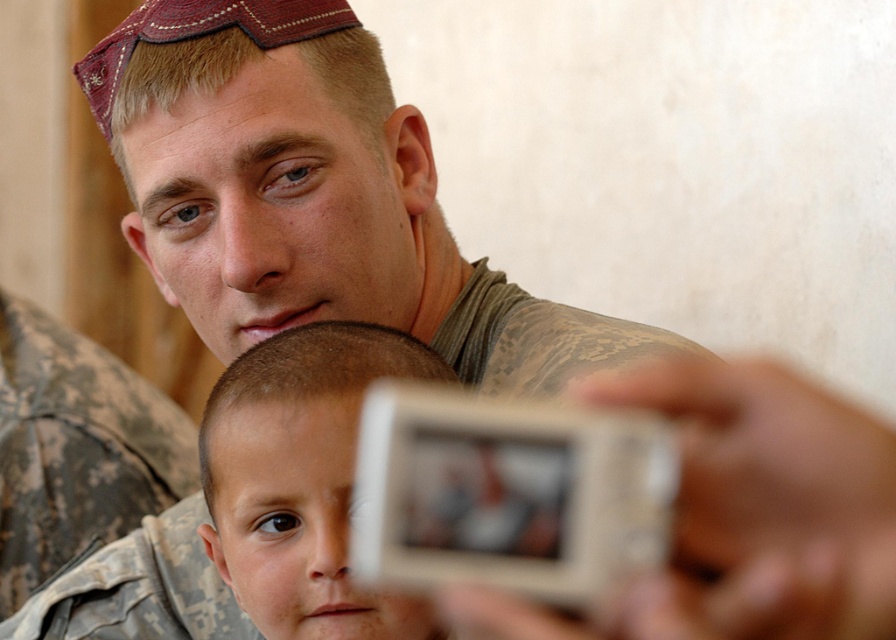
Between smooth skin boy at center and camouflage fabric uniform at upper center, which one has more height?

smooth skin boy at center

Can you confirm if smooth skin boy at center is positioned to the left of camouflage fabric uniform at upper center?

Indeed, smooth skin boy at center is positioned on the left side of camouflage fabric uniform at upper center.

Is point (230, 508) positioned before point (194, 598)?

Yes, point (230, 508) is in front of point (194, 598).

Locate an element on the screen. smooth skin boy at center is located at coordinates (302, 480).